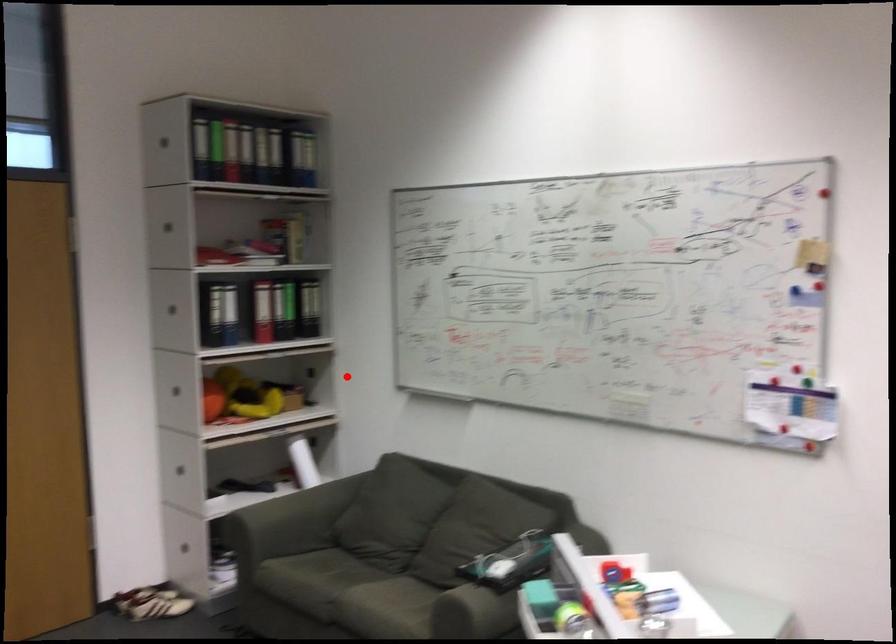
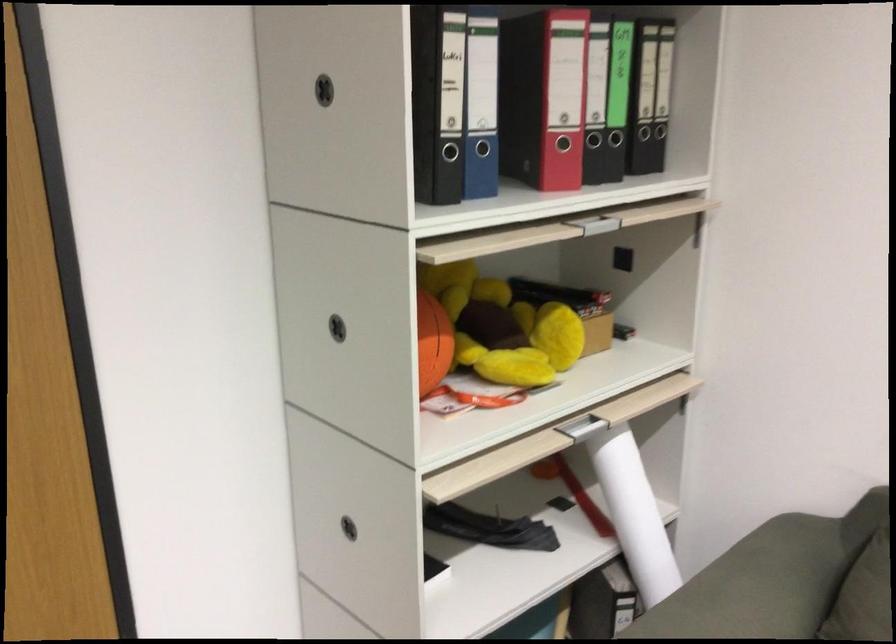
Question: I am providing you with two images of the same scene from different viewpoints. A red point is marked on the first image. Is the red point's position out of view in image 2?

Choices:
 (A) Yes
 (B) No

Answer: (B)